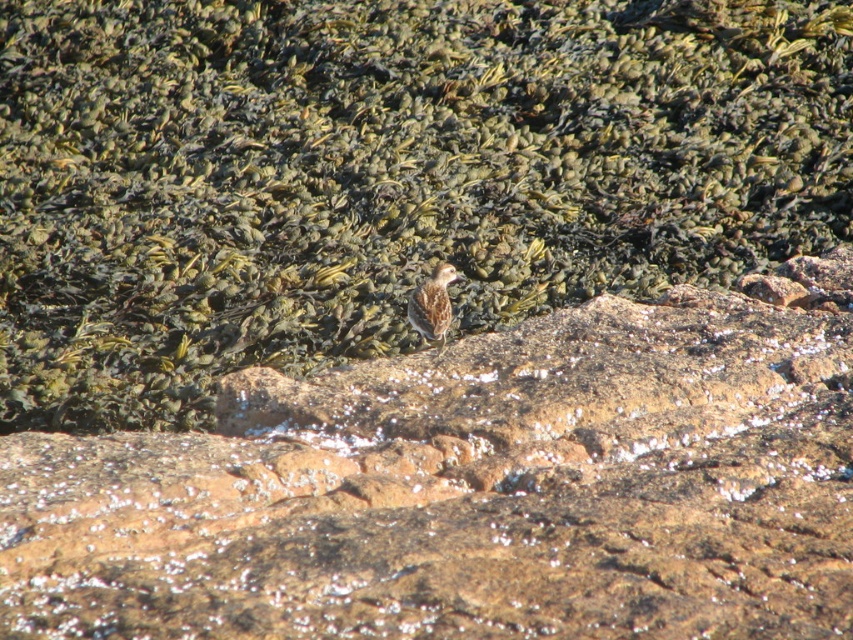
Is brown textured rock at center taller than brown rock at center?

Incorrect, brown textured rock at center's height is not larger of brown rock at center's.

At what (x,y) coordinates should I click in order to perform the action: click on brown textured rock at center. Please return your answer as a coordinate pair (x, y). The width and height of the screenshot is (853, 640). Looking at the image, I should click on (381, 177).

From the picture: Does brown textured rock at center have a greater height compared to brown speckled feather at center?

Correct, brown textured rock at center is much taller as brown speckled feather at center.

Does brown textured rock at center have a lesser height compared to brown speckled feather at center?

No, brown textured rock at center is not shorter than brown speckled feather at center.

The image size is (853, 640). I want to click on brown textured rock at center, so click(x=381, y=177).

Is brown rock at center wider than brown speckled feather at center?

Correct, the width of brown rock at center exceeds that of brown speckled feather at center.

Which of these two, brown rock at center or brown speckled feather at center, stands taller?

brown rock at center

Which is in front, point (166, 576) or point (422, 310)?

Positioned in front is point (166, 576).

This screenshot has width=853, height=640. What are the coordinates of `brown rock at center` in the screenshot? It's located at (474, 486).